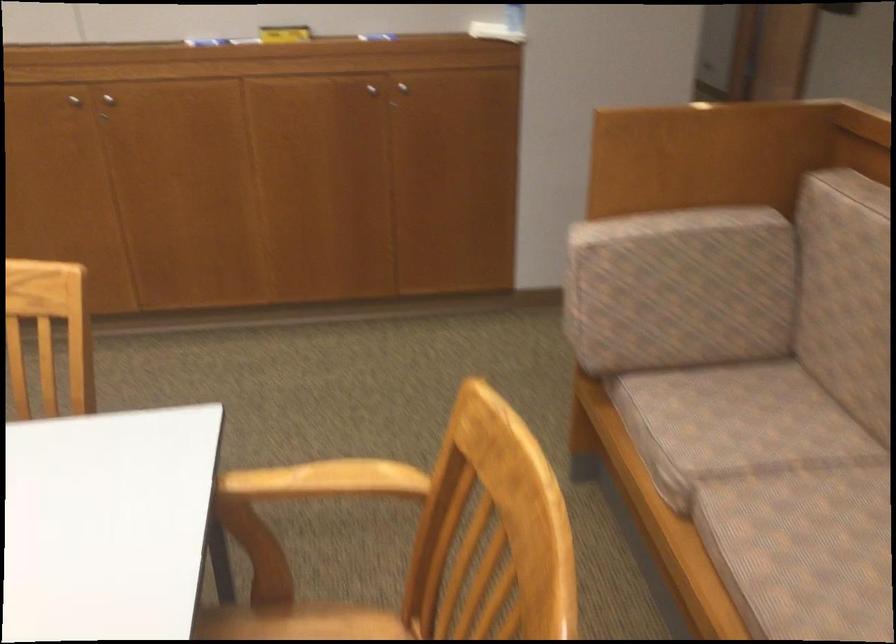
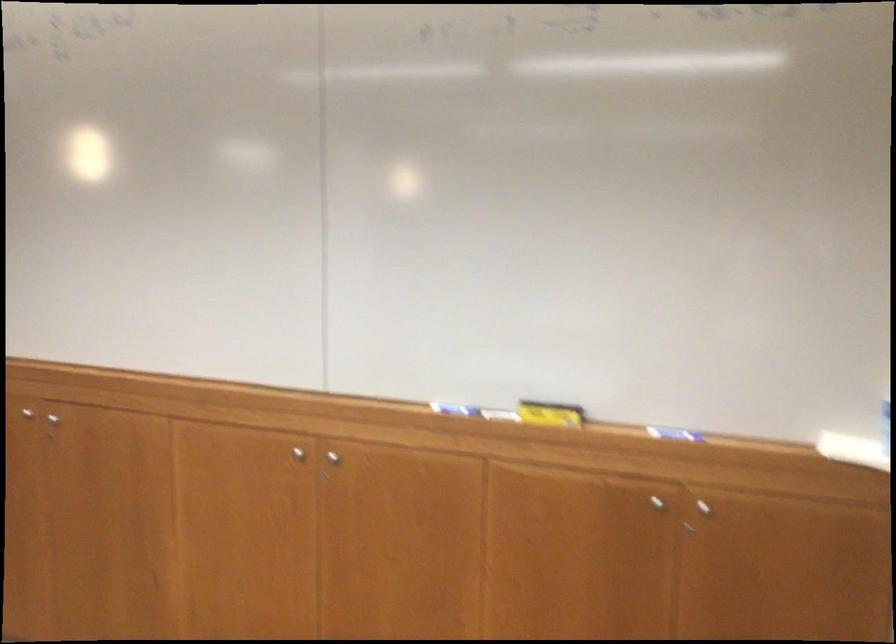
First-person continuous shooting, in which direction is the camera rotating?

The camera's rotation is toward left-up.